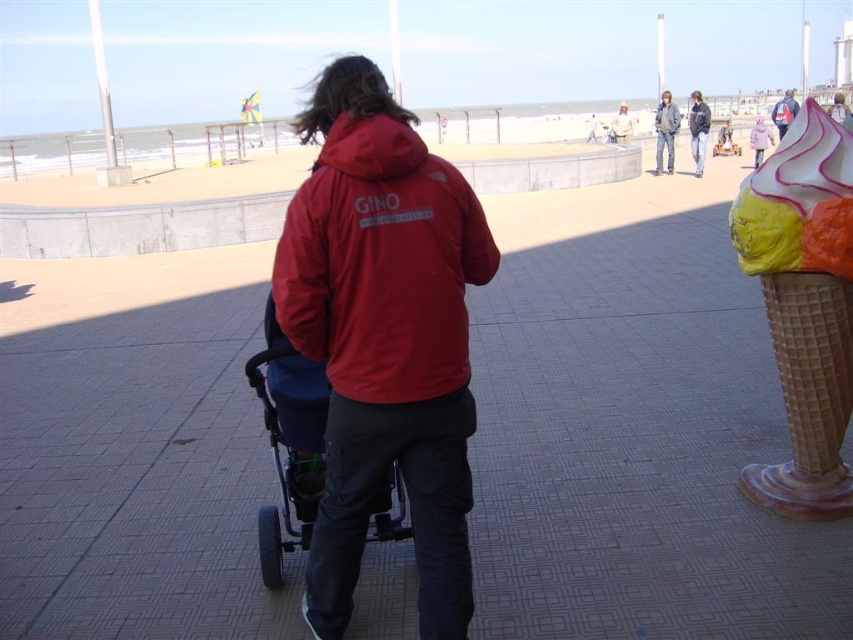
Question: Is denim jacket at upper right to the right of dark gray jacket at upper right from the viewer's perspective?

Choices:
 (A) yes
 (B) no

Answer: (B)

Question: Does white waffle cone at right have a greater width compared to dark gray jacket at upper right?

Choices:
 (A) no
 (B) yes

Answer: (A)

Question: Which point is closer to the camera taking this photo?

Choices:
 (A) (677, 118)
 (B) (660, 113)

Answer: (A)

Question: Which of the following is the closest to the observer?

Choices:
 (A) [784, 129]
 (B) [664, 122]

Answer: (B)

Question: Which point is farther to the camera?

Choices:
 (A) blue denim jacket at upper right
 (B) red matte jacket at center

Answer: (A)

Question: Can you confirm if blue fabric baby carriage at center is smaller than dark gray jacket at upper right?

Choices:
 (A) no
 (B) yes

Answer: (B)